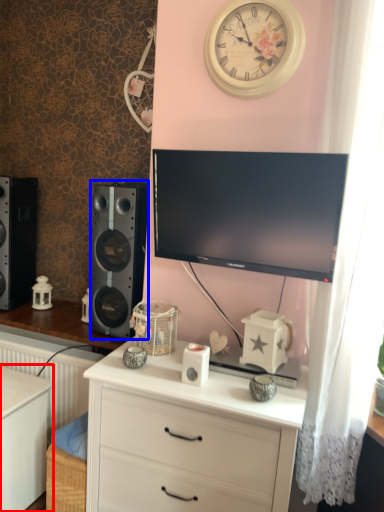
Question: Which object is further to the camera taking this photo, changing table (highlighted by a red box) or speaker (highlighted by a blue box)?

Choices:
 (A) changing table
 (B) speaker

Answer: (B)